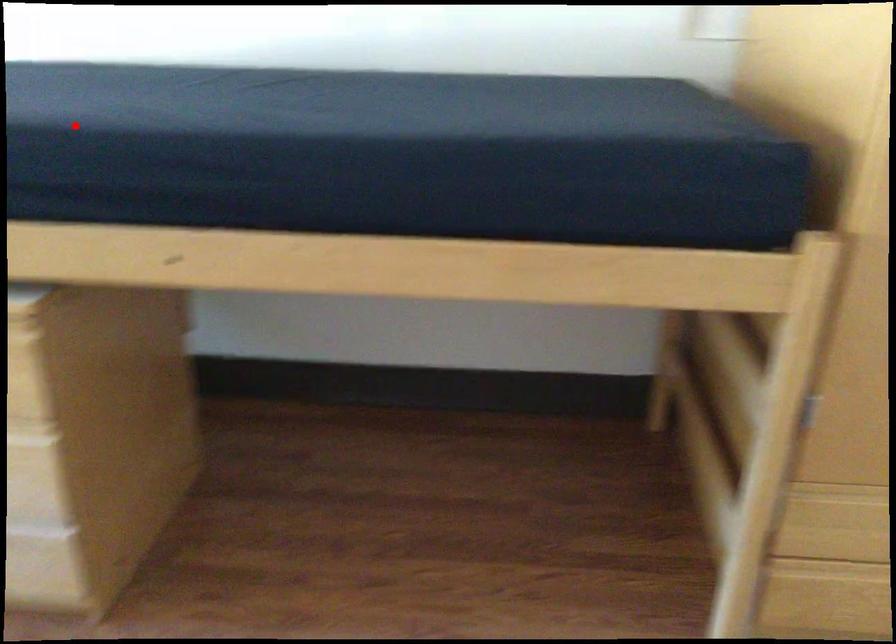
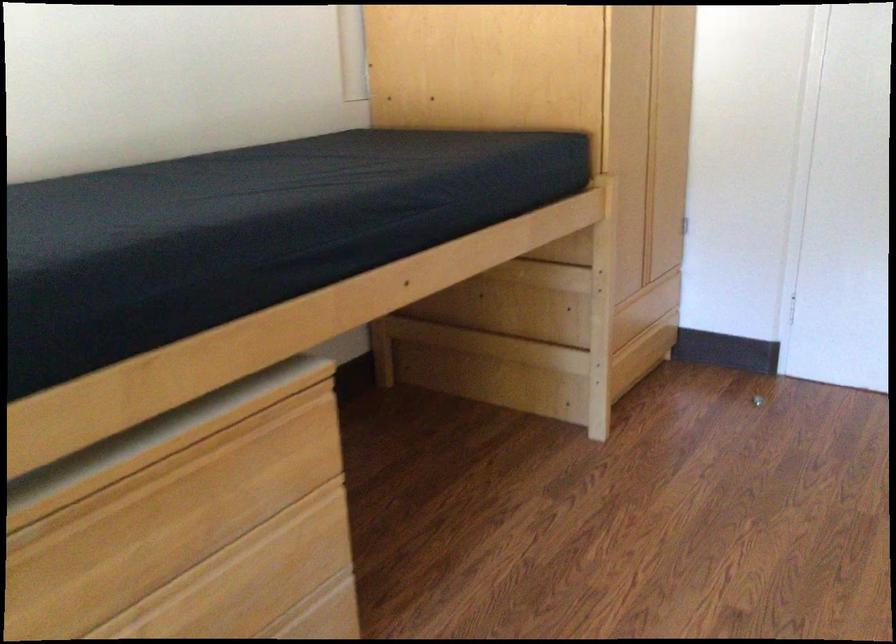
Question: I am providing you with two images of the same scene from different viewpoints. A red point is shown in image1. For the corresponding object point in image2, is it positioned nearer or farther from the camera?

Choices:
 (A) Nearer
 (B) Farther

Answer: (B)